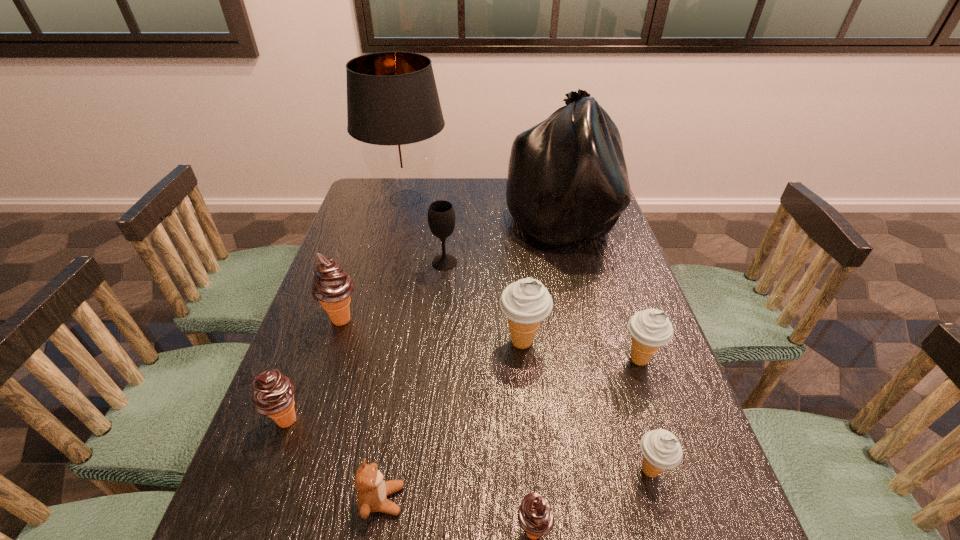
Where is `beige icecream that stands as the second closest to the biggest beige icecream`? This screenshot has height=540, width=960. beige icecream that stands as the second closest to the biggest beige icecream is located at coordinates (661, 450).

At what (x,y) coordinates should I click in order to perform the action: click on chocolate icecream that is the closest one to the second smallest beige icecream. Please return your answer as a coordinate pair (x, y). This screenshot has height=540, width=960. Looking at the image, I should click on (535, 516).

Identify the location of chocolate icecream that is the second closest to the third nearest icecream. (535, 516).

Locate an element on the screen. Image resolution: width=960 pixels, height=540 pixels. vacant space that satisfies the following two spatial constraints: 1. on the front side of the lampshade; 2. on the left side of the wineglass is located at coordinates [390, 262].

This screenshot has height=540, width=960. In order to click on vacant point that satisfies the following two spatial constraints: 1. on the front side of the smallest beige icecream; 2. on the right side of the plastic bag in this screenshot , I will do `click(619, 471)`.